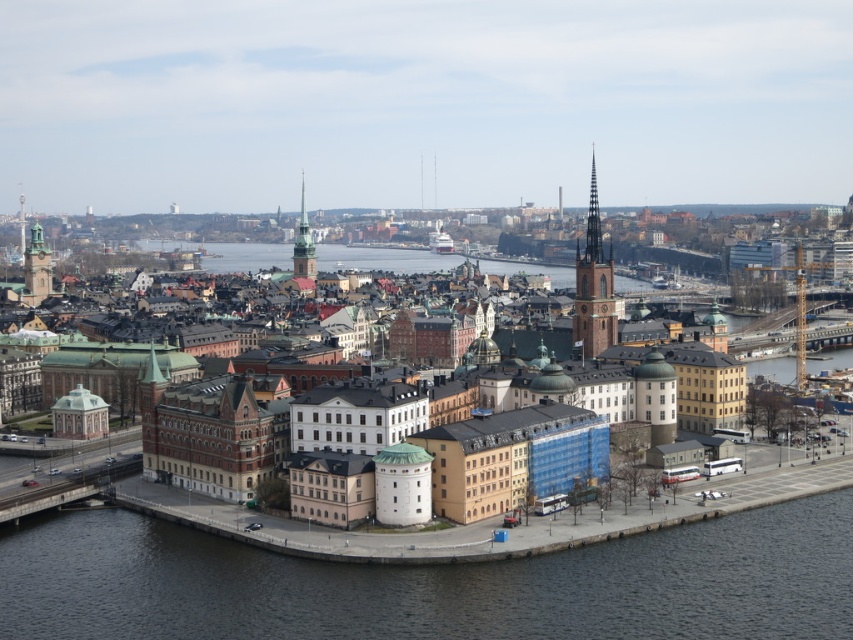
Question: Can you confirm if dark gray water at lower center is positioned above matte copper clock tower at left?

Choices:
 (A) yes
 (B) no

Answer: (B)

Question: Which object is the farthest from the matte copper clock tower at left?

Choices:
 (A) dark gray water at lower center
 (B) green stone tower at center
 (C) brown stone tower at center

Answer: (A)

Question: Is dark gray water at lower center behind brown stone tower at center?

Choices:
 (A) yes
 (B) no

Answer: (B)

Question: Is dark gray water at lower center to the left of green stone tower at center from the viewer's perspective?

Choices:
 (A) no
 (B) yes

Answer: (A)

Question: Which object is the farthest from the green stone tower at center?

Choices:
 (A) matte copper clock tower at left
 (B) dark gray water at lower center

Answer: (B)

Question: Which object appears farthest from the camera in this image?

Choices:
 (A) matte copper clock tower at left
 (B) dark gray water at lower center
 (C) green stone tower at center

Answer: (C)